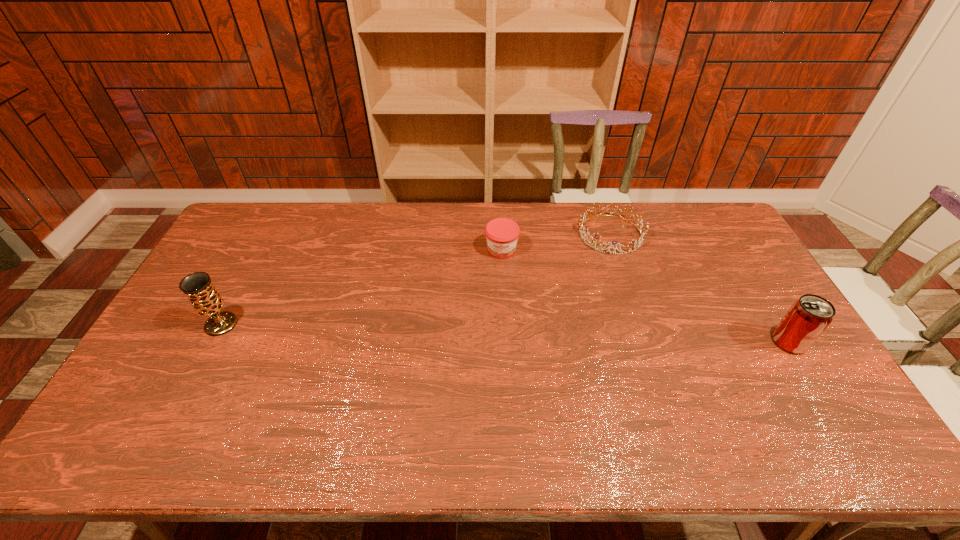
You are a GUI agent. You are given a task and a screenshot of the screen. Output one action in this format:
    pyautogui.click(x=<x>, y=<y>)
    Task: Click on the empty space that is in between the second shortest object and the chalice
    Image resolution: width=960 pixels, height=540 pixels.
    Given the screenshot: What is the action you would take?
    pyautogui.click(x=361, y=287)

You are a GUI agent. You are given a task and a screenshot of the screen. Output one action in this format:
    pyautogui.click(x=<x>, y=<y>)
    Task: Click on the vacant area that lies between the leftmost object and the third shortest object
    
    Given the screenshot: What is the action you would take?
    pyautogui.click(x=505, y=333)

Image resolution: width=960 pixels, height=540 pixels. Identify the location of unoccupied position between the third tallest object and the chalice. (361, 287).

Where is `object that is the closest to the second object from right to left`? object that is the closest to the second object from right to left is located at coordinates (502, 234).

The height and width of the screenshot is (540, 960). In order to click on object that is the third nearest to the pop soda in this screenshot , I will do `click(205, 299)`.

Find the location of a particular element. vacant space that satisfies the following two spatial constraints: 1. on the front side of the third object from left to right; 2. on the left side of the rightmost object is located at coordinates (646, 342).

Locate an element on the screen. The height and width of the screenshot is (540, 960). free region that satisfies the following two spatial constraints: 1. on the front side of the third object from right to left; 2. on the left side of the rightmost object is located at coordinates (506, 342).

Find the location of a particular element. vacant space that satisfies the following two spatial constraints: 1. on the front side of the chalice; 2. on the left side of the pop soda is located at coordinates (212, 342).